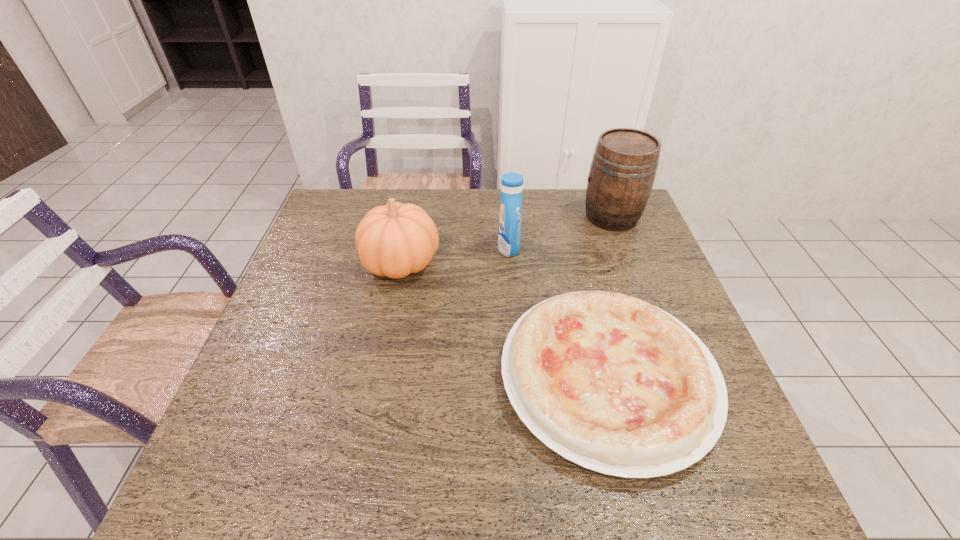
This screenshot has width=960, height=540. What are the coordinates of `the farthest object` in the screenshot? It's located at (624, 165).

Locate an element on the screen. This screenshot has height=540, width=960. detergent is located at coordinates (509, 233).

Locate an element on the screen. This screenshot has width=960, height=540. pumpkin is located at coordinates (394, 240).

This screenshot has height=540, width=960. I want to click on pizza, so click(x=608, y=381).

The height and width of the screenshot is (540, 960). In order to click on the shortest object in this screenshot , I will do `click(608, 381)`.

I want to click on free space located on the side of the cider near the bung hole, so click(463, 217).

You are a GUI agent. You are given a task and a screenshot of the screen. Output one action in this format:
    pyautogui.click(x=<x>, y=<y>)
    Task: Click on the vacant space located on the side of the cider near the bung hole
    The width and height of the screenshot is (960, 540).
    Given the screenshot: What is the action you would take?
    pyautogui.click(x=538, y=217)

You are a GUI agent. You are given a task and a screenshot of the screen. Output one action in this format:
    pyautogui.click(x=<x>, y=<y>)
    Task: Click on the vacant space located 0.320m on the side of the cider near the bung hole
    Image resolution: width=960 pixels, height=540 pixels.
    Given the screenshot: What is the action you would take?
    pyautogui.click(x=482, y=217)

This screenshot has width=960, height=540. I want to click on vacant space located 0.190m on the front-facing side of the detergent, so click(434, 248).

Locate an element on the screen. Image resolution: width=960 pixels, height=540 pixels. blank space located 0.240m on the front-facing side of the detergent is located at coordinates (x=417, y=248).